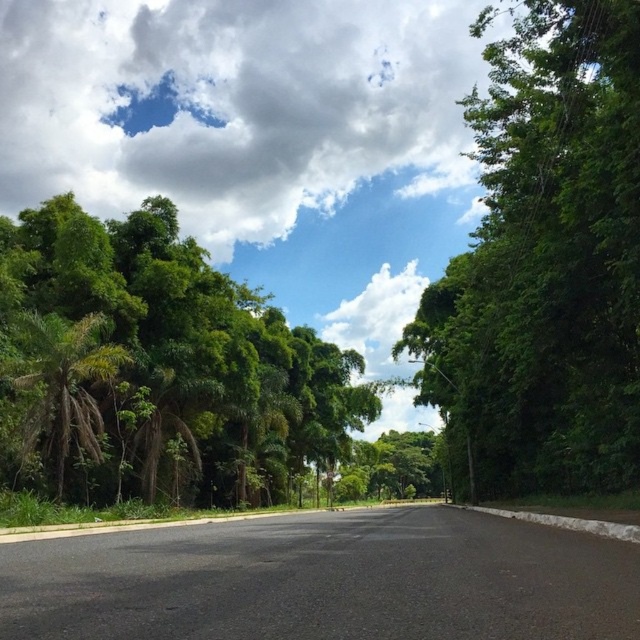
Question: Which point is farther from the camera taking this photo?

Choices:
 (A) (86, 371)
 (B) (104, 349)
 (C) (241, 163)
 (D) (420, 323)

Answer: (C)

Question: Which point is closer to the camera taking this photo?

Choices:
 (A) (88, 406)
 (B) (35, 136)
 (C) (515, 186)
 (D) (54, 476)

Answer: (C)

Question: Among these points, which one is nearest to the camera?

Choices:
 (A) (528, 369)
 (B) (44, 442)
 (C) (188, 225)
 (D) (244, 470)

Answer: (A)

Question: Can you confirm if white fluffy cloud at upper center is smaller than green leafy palm tree at left?

Choices:
 (A) no
 (B) yes

Answer: (A)

Question: Does green leafy tree at center appear over green leafy tree at left?

Choices:
 (A) yes
 (B) no

Answer: (A)

Question: Does white fluffy cloud at upper center appear over green leafy tree at center?

Choices:
 (A) no
 (B) yes

Answer: (B)